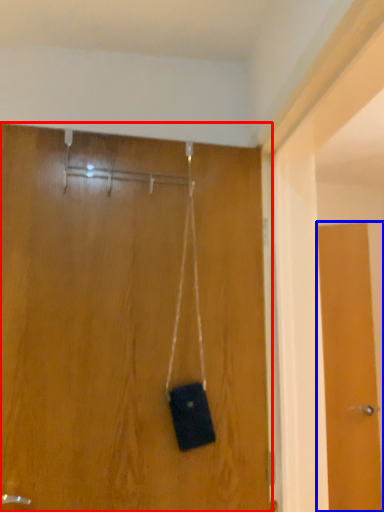
Question: Which object is further to the camera taking this photo, door (highlighted by a red box) or door (highlighted by a blue box)?

Choices:
 (A) door
 (B) door

Answer: (B)